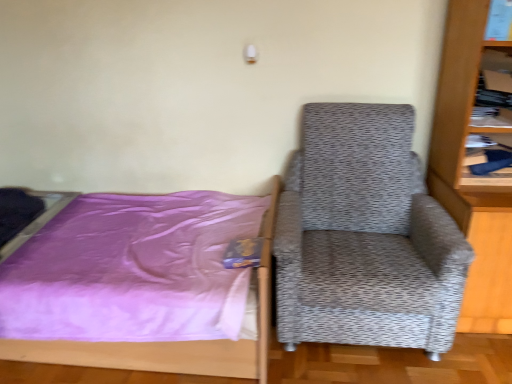
Question: Looking at the image, does purple satin bed at left seem bigger or smaller compared to gray textured armchair at right?

Choices:
 (A) big
 (B) small

Answer: (A)

Question: In terms of width, does purple satin bed at left look wider or thinner when compared to gray textured armchair at right?

Choices:
 (A) wide
 (B) thin

Answer: (A)

Question: Which is nearer to the gray textured armchair at right?

Choices:
 (A) purple satin bed at left
 (B) wooden bookshelf at upper right
 (C) wooden bookcase at right

Answer: (C)

Question: Which object is the farthest from the wooden bookshelf at upper right?

Choices:
 (A) gray textured armchair at right
 (B) purple satin bed at left
 (C) wooden bookcase at right

Answer: (B)